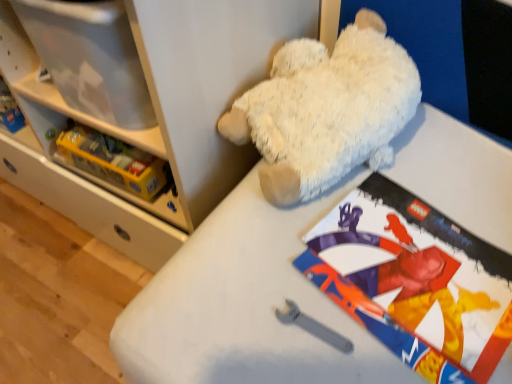
Question: From the image's perspective, is matte paper comic book at upper center located above or below yellow plastic lego box at left, the second shelf in the front-to-back sequence?

Choices:
 (A) below
 (B) above

Answer: (A)

Question: Looking at their shapes, would you say matte paper comic book at upper center is wider or thinner than yellow plastic lego box at left, the second shelf in the front-to-back sequence?

Choices:
 (A) wide
 (B) thin

Answer: (A)

Question: Considering the real-world distances, which object is closest to the white plush bear at upper right, acting as the first shelf starting from the front?

Choices:
 (A) yellow plastic lego box at left, arranged as the 1th shelf when viewed from the back
 (B) matte paper comic book at upper center
 (C) white plush teddy bear at upper center

Answer: (A)

Question: Based on their relative distances, which object is farther from the white plush bear at upper right, acting as the first shelf starting from the front?

Choices:
 (A) matte paper comic book at upper center
 (B) white plush teddy bear at upper center
 (C) yellow plastic lego box at left, the second shelf in the front-to-back sequence

Answer: (A)